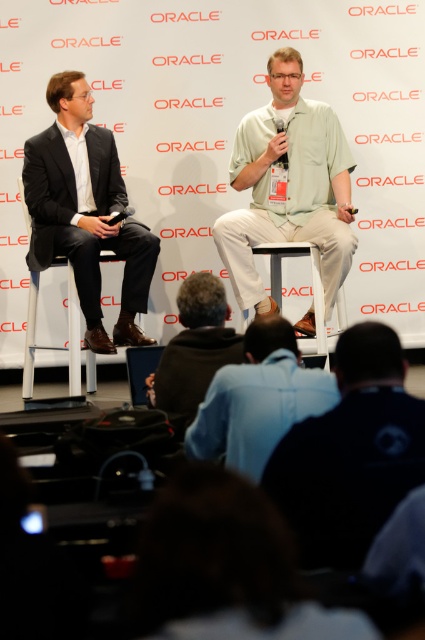
Is dark brown hair at lower center below white plastic chair at center?

Indeed, dark brown hair at lower center is positioned under white plastic chair at center.

Is point (209, 480) farther from viewer compared to point (339, 307)?

No, it is in front of (339, 307).

Identify the location of dark brown hair at lower center. (223, 566).

Does point (238, 600) come in front of point (282, 156)?

Yes, point (238, 600) is in front of point (282, 156).

Which is behind, point (215, 525) or point (297, 156)?

The point (297, 156) is behind.

This screenshot has height=640, width=425. In order to click on dark brown hair at lower center in this screenshot , I will do `click(223, 566)`.

Where is `dark brown hair at lower center`? The image size is (425, 640). dark brown hair at lower center is located at coordinates pos(223,566).

Between point (192, 620) and point (27, 148), which one is positioned behind?

The point (27, 148) is more distant.

Can you confirm if dark brown hair at lower center is positioned above matte black suit at left?

No, dark brown hair at lower center is not above matte black suit at left.

Between point (217, 625) and point (113, 234), which one is positioned behind?

The point (113, 234) is behind.

Locate an element on the screen. This screenshot has height=640, width=425. dark brown hair at lower center is located at coordinates (223, 566).